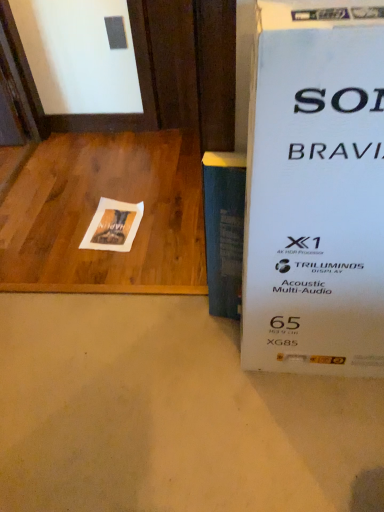
Find the location of a particular element. free space above wooden at left (from a real-world perspective) is located at coordinates (91, 199).